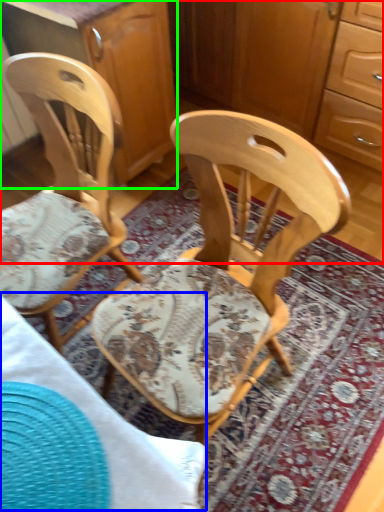
Question: Which object is positioned farthest from dresser (highlighted by a red box)? Select from table (highlighted by a blue box) and cabinetry (highlighted by a green box).

Choices:
 (A) table
 (B) cabinetry

Answer: (A)